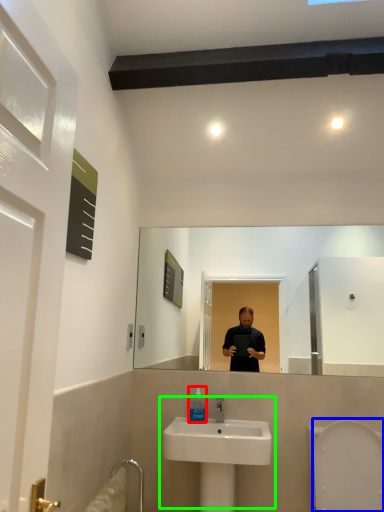
Question: Which is farther away from mouthwash (highlighted by a red box)? bidet (highlighted by a blue box) or sink (highlighted by a green box)?

Choices:
 (A) bidet
 (B) sink

Answer: (A)